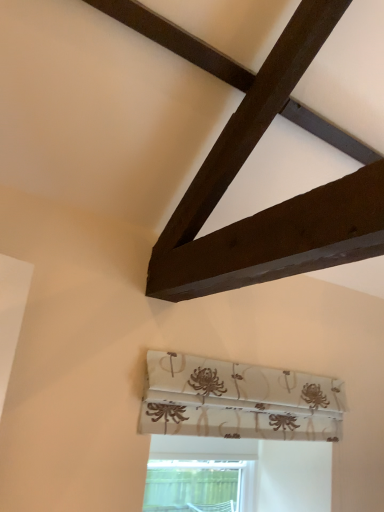
Describe the element at coordinates (198, 472) in the screenshot. I see `white fabric at lower center` at that location.

Where is `white fabric at lower center`? This screenshot has height=512, width=384. white fabric at lower center is located at coordinates (198, 472).

I want to click on white fabric at lower center, so click(198, 472).